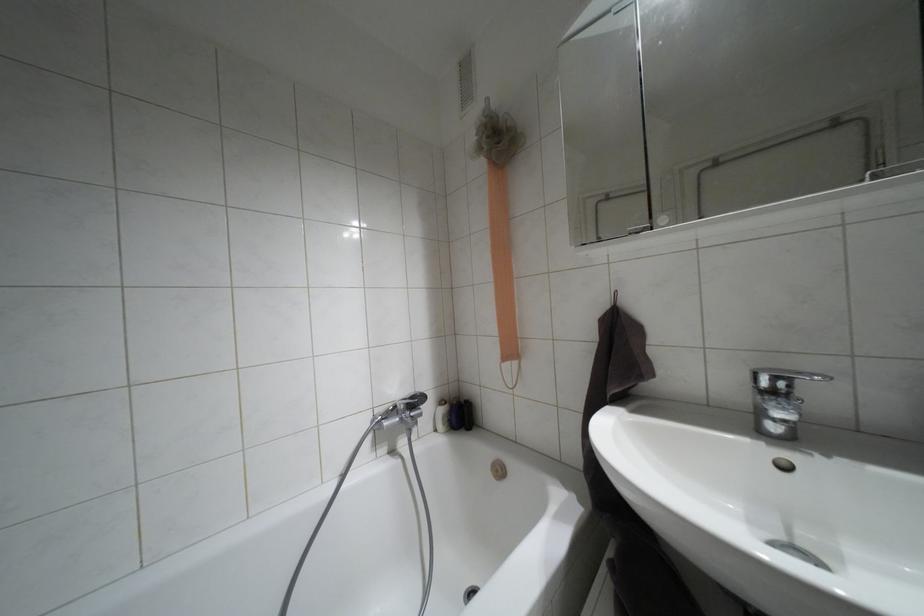
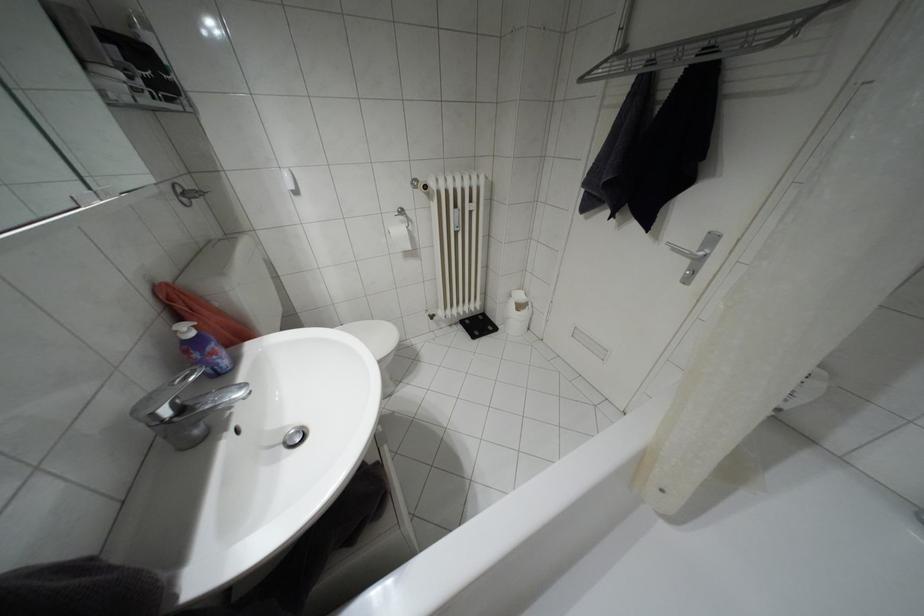
Locate, in the second image, the point that corresponds to pixel 772 392 in the first image.

(180, 408)